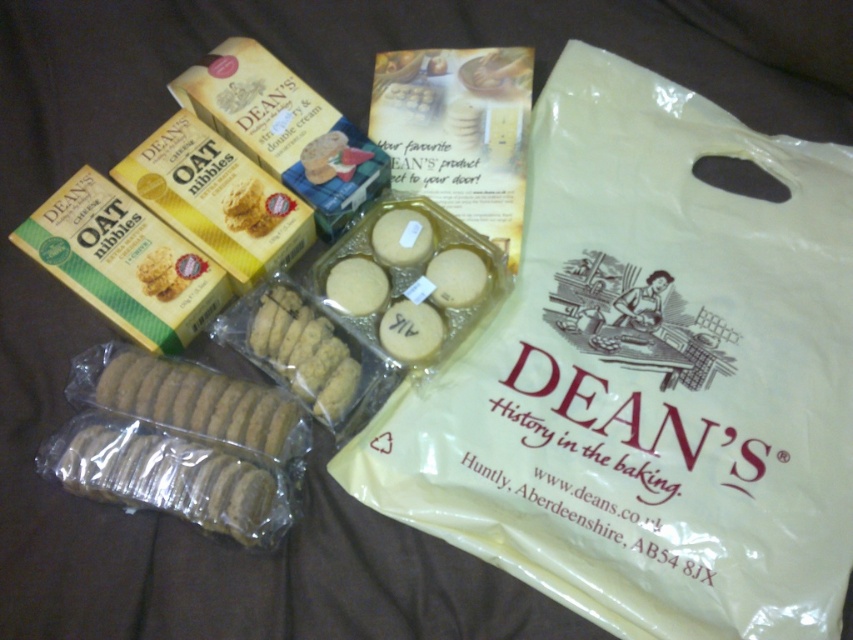
Question: Does beige plastic bag at upper right have a lesser width compared to brown matte cookie at center?

Choices:
 (A) yes
 (B) no

Answer: (B)

Question: Can you confirm if translucent plastic cookies at lower left is thinner than brown matte cookie at center?

Choices:
 (A) no
 (B) yes

Answer: (A)

Question: Which point is farther from the camera taking this photo?

Choices:
 (A) (578, 72)
 (B) (131, 464)

Answer: (A)

Question: Which object is the farthest from the brown matte cookie at center?

Choices:
 (A) matte plastic cheese at center
 (B) brown matte cookie at lower left

Answer: (A)

Question: Does beige plastic bag at upper right have a smaller size compared to brown matte cookie at center?

Choices:
 (A) no
 (B) yes

Answer: (A)

Question: Among these objects, which one is farthest from the camera?

Choices:
 (A) matte plastic cheese at center
 (B) brown matte cookie at lower left
 (C) brown matte cookie at center
 (D) beige plastic bag at upper right

Answer: (A)